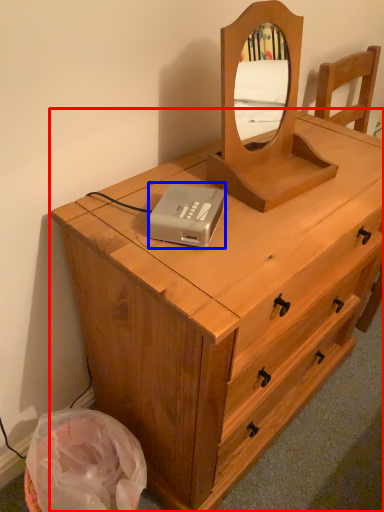
Question: Which object is further to the camera taking this photo, chest of drawers (highlighted by a red box) or cassette (highlighted by a blue box)?

Choices:
 (A) chest of drawers
 (B) cassette

Answer: (B)